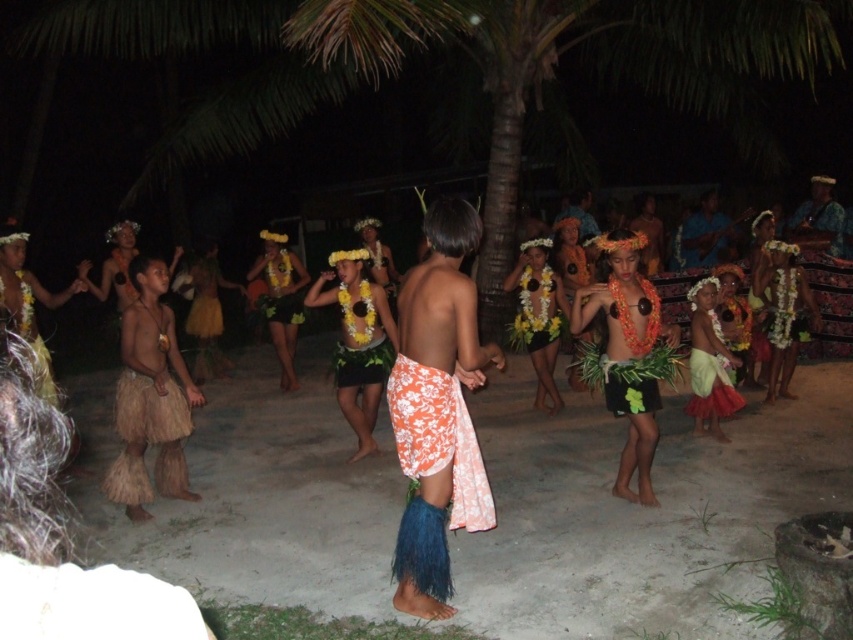
Question: Considering the relative positions of floral fabric skirt at center and blue fabric guitar at center in the image provided, where is floral fabric skirt at center located with respect to blue fabric guitar at center?

Choices:
 (A) below
 (B) above

Answer: (A)

Question: Which of the following is the farthest from the observer?

Choices:
 (A) floral fabric skirt at center
 (B) blue fabric guitar at center

Answer: (B)

Question: Can you confirm if floral fabric skirt at center is bigger than blue fabric guitar at center?

Choices:
 (A) yes
 (B) no

Answer: (B)

Question: Which point is farther from the camera taking this photo?

Choices:
 (A) (445, 541)
 (B) (714, 198)

Answer: (B)

Question: Can you confirm if floral fabric skirt at center is positioned below blue fabric guitar at center?

Choices:
 (A) yes
 (B) no

Answer: (A)

Question: Which point is farther to the camera?

Choices:
 (A) (689, 227)
 (B) (471, 243)

Answer: (A)